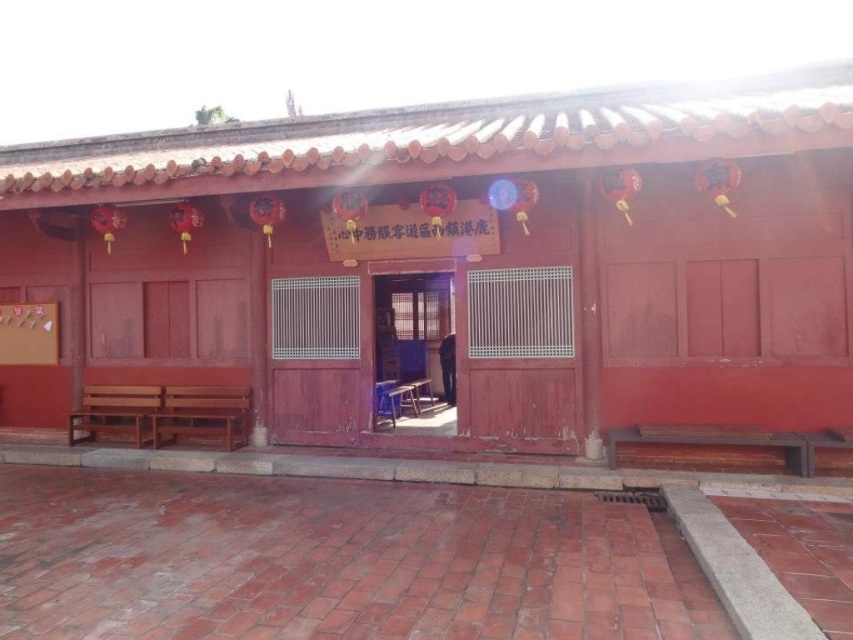
Between matte wood hut at center and wooden door at center, which one appears on the left side from the viewer's perspective?

Positioned to the left is wooden door at center.

Who is positioned more to the right, matte wood hut at center or wooden door at center?

From the viewer's perspective, matte wood hut at center appears more on the right side.

Who is more forward, (33,241) or (433,304)?

Positioned in front is point (33,241).

Locate an element on the screen. The width and height of the screenshot is (853, 640). matte wood hut at center is located at coordinates (467, 268).